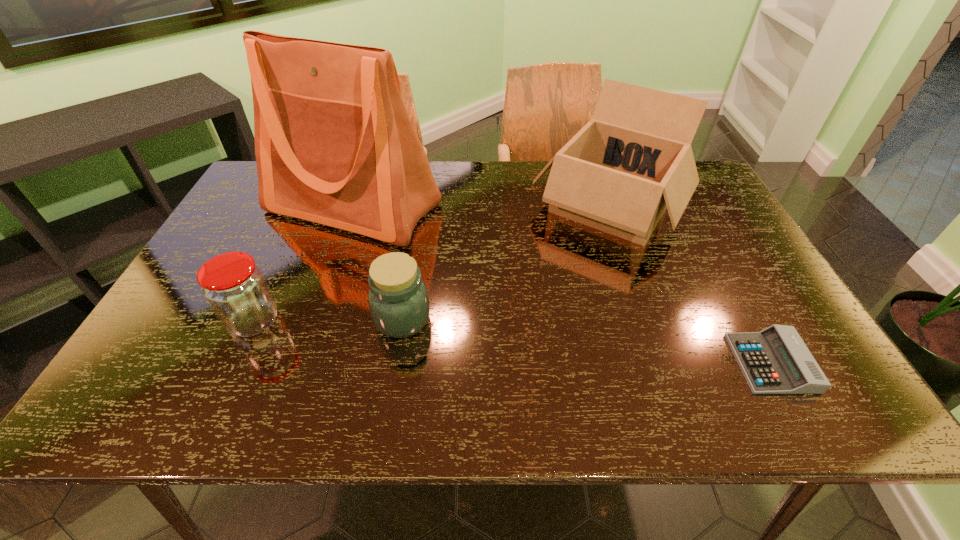
In order to click on shopping bag in this screenshot , I will do `click(334, 145)`.

The height and width of the screenshot is (540, 960). What are the coordinates of `the second tallest object` in the screenshot? It's located at 633,159.

Where is `the left jar`? The image size is (960, 540). the left jar is located at coordinates (235, 288).

The width and height of the screenshot is (960, 540). Identify the location of the right jar. [x=398, y=300].

Find the location of a particular element. calculator is located at coordinates (776, 360).

Find the location of a particular element. This screenshot has width=960, height=540. free space located on the right of the shopping bag is located at coordinates (575, 208).

I want to click on free space located on the front of the box, so click(x=674, y=390).

Where is `blank area located on the back of the left jar`? blank area located on the back of the left jar is located at coordinates (279, 268).

Where is `vacant space situated on the right of the right jar`? The height and width of the screenshot is (540, 960). vacant space situated on the right of the right jar is located at coordinates (594, 319).

The image size is (960, 540). Find the location of `free space located 0.280m on the back of the shortest object`. free space located 0.280m on the back of the shortest object is located at coordinates (709, 253).